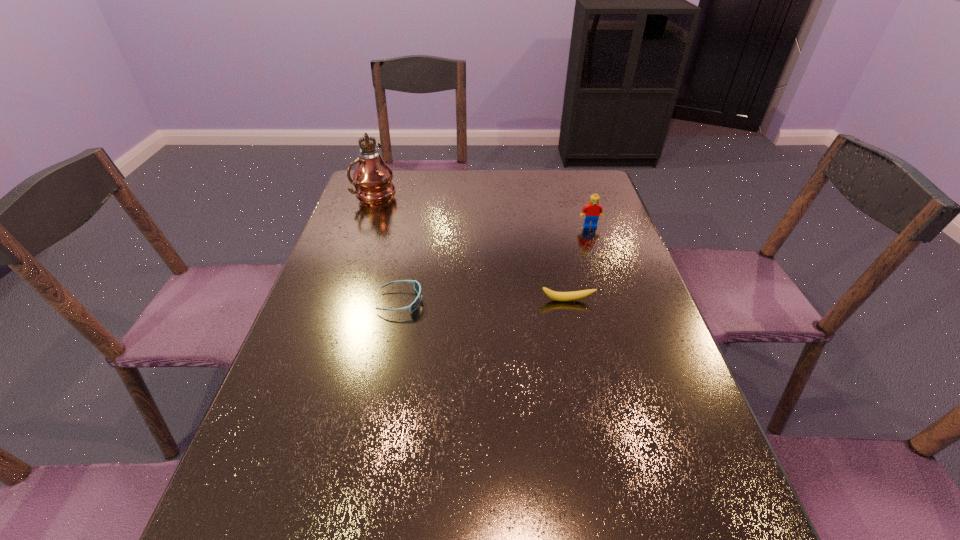
Point out which object is positioned as the second nearest to the goggles. Please provide its 2D coordinates. Your answer should be formatted as a tuple, i.e. [(x, y)], where the tuple contains the x and y coordinates of a point satisfying the conditions above.

[(372, 177)]

Identify which object is the closest to the second shortest object. Please provide its 2D coordinates. Your answer should be formatted as a tuple, i.e. [(x, y)], where the tuple contains the x and y coordinates of a point satisfying the conditions above.

[(417, 287)]

This screenshot has width=960, height=540. Identify the location of free space that satisfies the following two spatial constraints: 1. on the upward curve of the banana; 2. on the front-facing side of the shortest object. (567, 301).

I want to click on vacant space that satisfies the following two spatial constraints: 1. on the upward curve of the banana; 2. on the front-facing side of the shortest object, so click(567, 301).

Locate an element on the screen. The width and height of the screenshot is (960, 540). vacant area that satisfies the following two spatial constraints: 1. on the upward curve of the second shortest object; 2. on the front-facing side of the goggles is located at coordinates (567, 301).